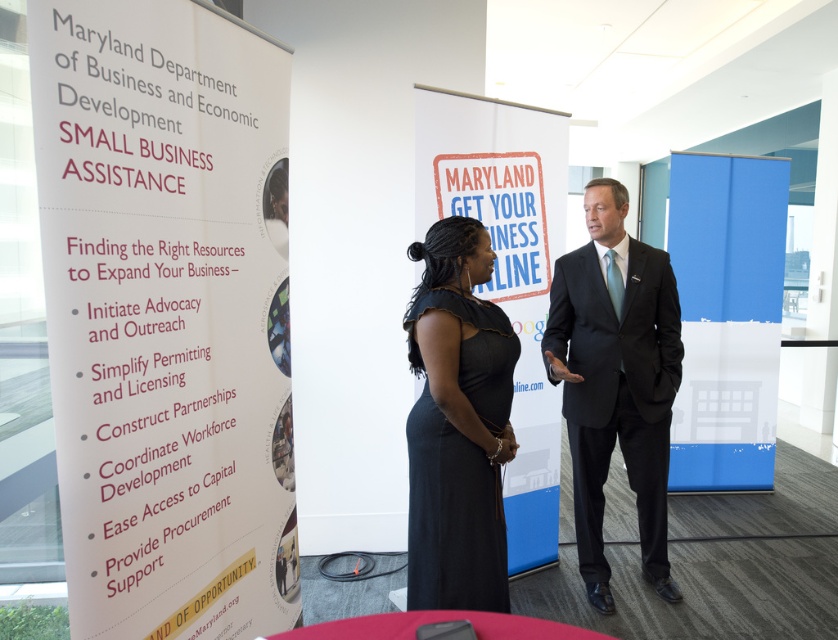
Looking at this image, can you confirm if white paper at left is wider than black suit at center?

No.

Who is lower down, white paper at left or black suit at center?

black suit at center

Between point (205, 337) and point (599, 220), which one is positioned in front?

Positioned in front is point (205, 337).

You are a GUI agent. You are given a task and a screenshot of the screen. Output one action in this format:
    pyautogui.click(x=<x>, y=<y>)
    Task: Click on the white paper at left
    The height and width of the screenshot is (640, 838).
    Given the screenshot: What is the action you would take?
    pyautogui.click(x=167, y=314)

Who is more distant from viewer, [260,291] or [433,545]?

The point [260,291] is more distant.

Is white paper at left further to camera compared to black satin dress at center?

No, white paper at left is closer to the viewer.

Is point (210, 556) less distant than point (477, 579)?

Yes, point (210, 556) is closer to viewer.

The width and height of the screenshot is (838, 640). Identify the location of white paper at left. click(167, 314).

Is white paper at center thinner than black satin dress at center?

No.

You are a GUI agent. You are given a task and a screenshot of the screen. Output one action in this format:
    pyautogui.click(x=<x>, y=<y>)
    Task: Click on the white paper at center
    Image resolution: width=838 pixels, height=640 pixels.
    Given the screenshot: What is the action you would take?
    pyautogui.click(x=505, y=268)

This screenshot has height=640, width=838. Identify the location of white paper at center. (505, 268).